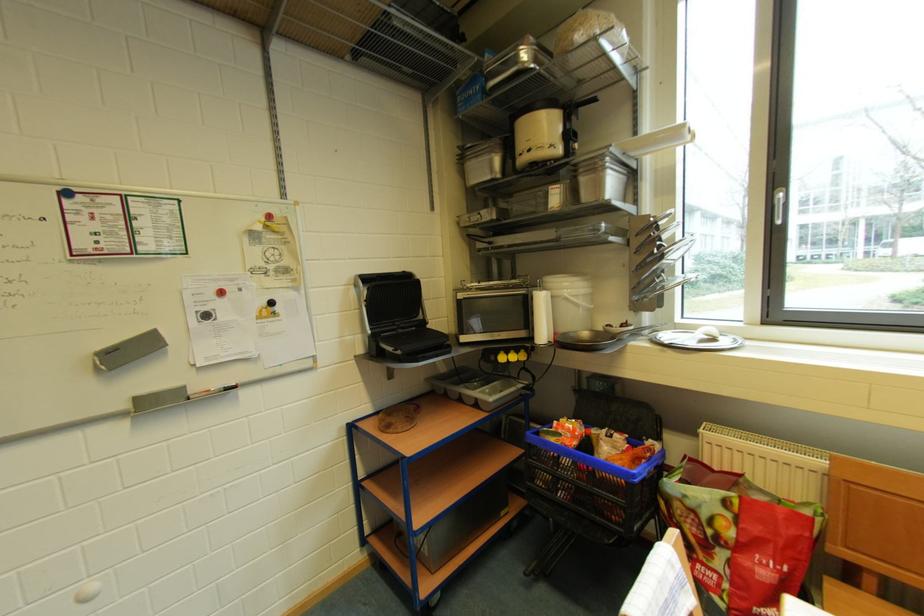
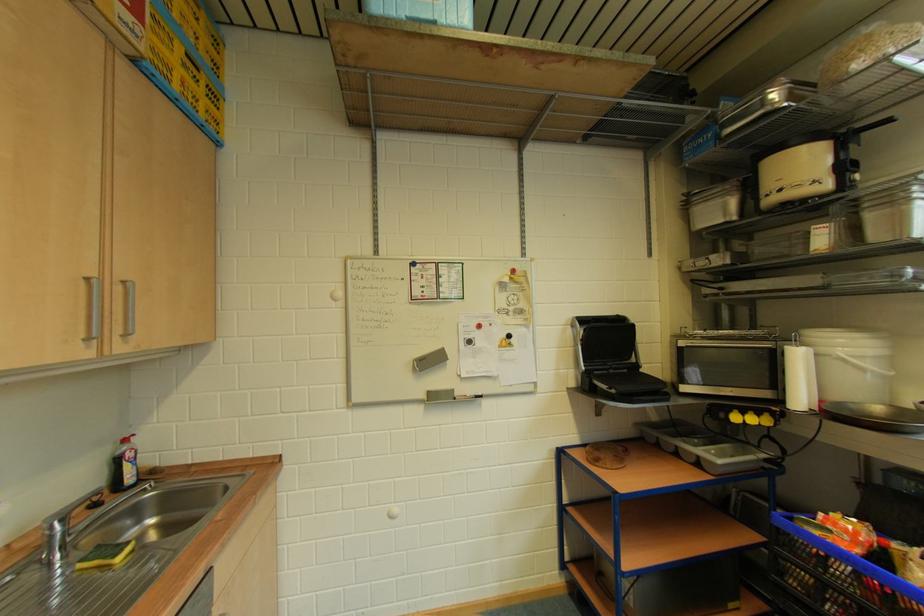
Locate, in the second image, the point that corresponds to point 103,361 in the first image.

(421, 365)